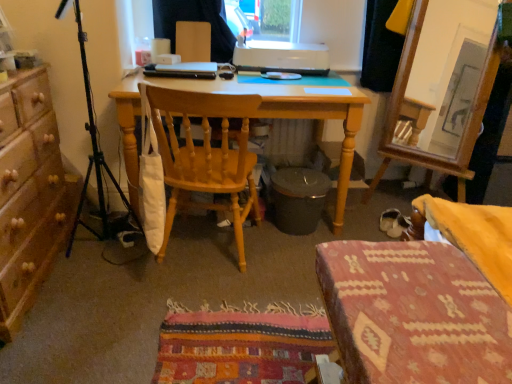
Where is `vacant space in wooden chair at center (from a real-world perspective)`? Image resolution: width=512 pixels, height=384 pixels. vacant space in wooden chair at center (from a real-world perspective) is located at coordinates (204, 251).